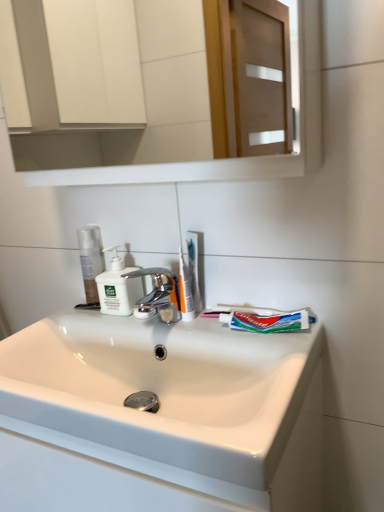
Locate an element on the screen. vacant space to the left of white matte soap dispenser at center is located at coordinates (66, 320).